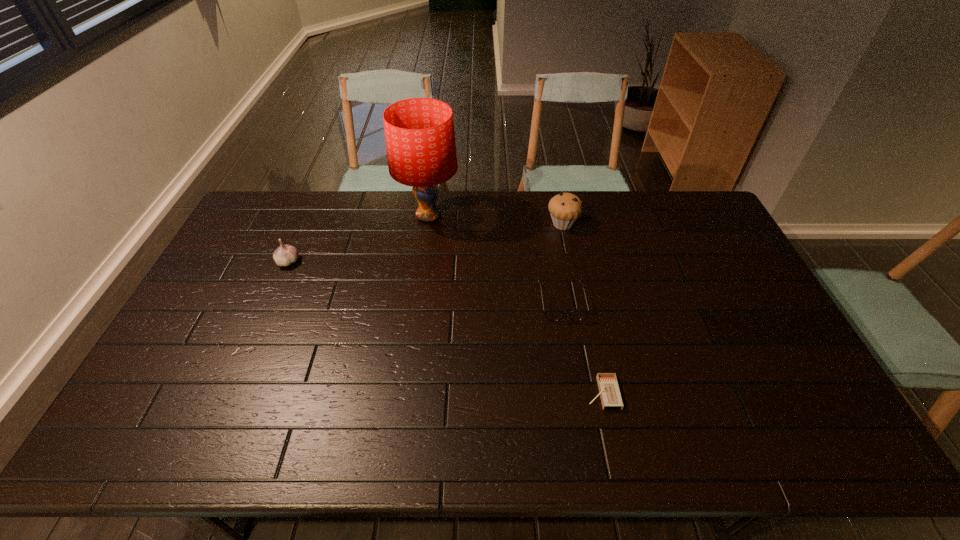
What are the coordinates of `the fourth object from right to left` in the screenshot? It's located at (420, 140).

Find the location of a particular element. This screenshot has height=540, width=960. lampshade is located at coordinates (420, 140).

In order to click on the second tallest object in this screenshot , I will do tap(565, 208).

The height and width of the screenshot is (540, 960). I want to click on the third tallest object, so click(285, 255).

The width and height of the screenshot is (960, 540). I want to click on garlic, so click(x=285, y=255).

This screenshot has width=960, height=540. What are the coordinates of `spectacles` in the screenshot? It's located at (553, 315).

In order to click on the fourth tallest object in this screenshot , I will do `click(553, 315)`.

Identify the location of the shortest object. The height and width of the screenshot is (540, 960). (609, 392).

Image resolution: width=960 pixels, height=540 pixels. Identify the location of the nearest object. (609, 392).

At what (x,y) coordinates should I click in order to perform the action: click on blank space located 0.180m on the front-facing side of the second object from left to right. Please return your answer as a coordinate pair (x, y). Looking at the image, I should click on point(509,216).